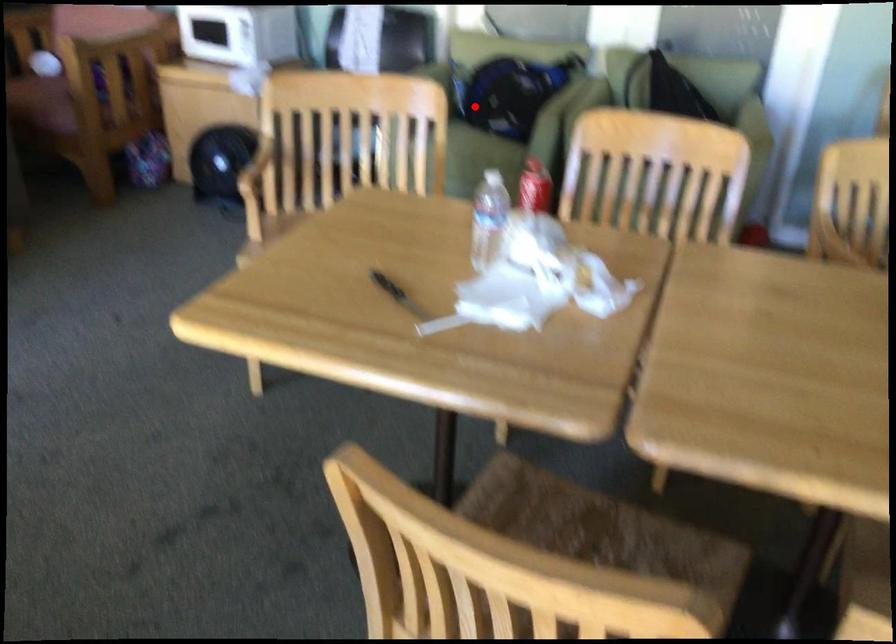
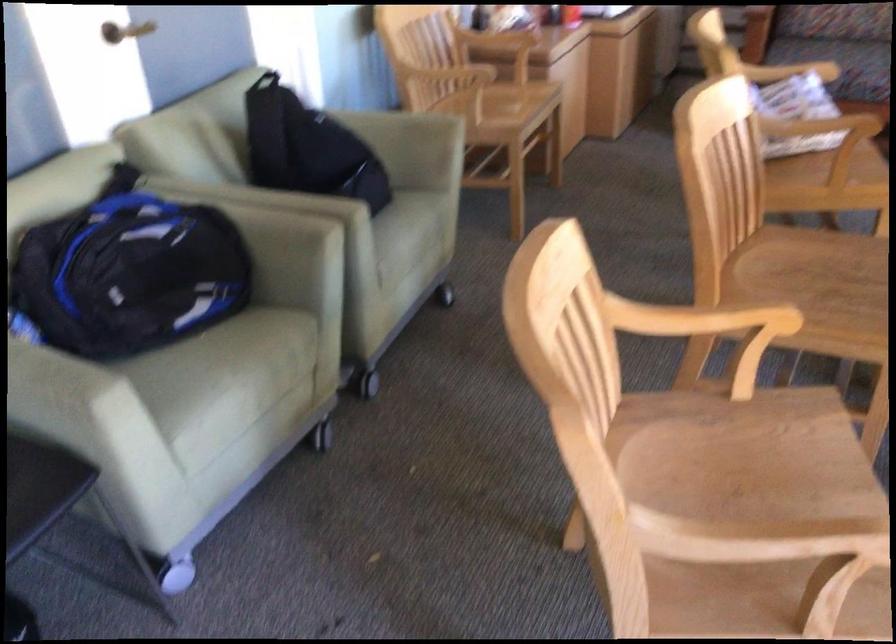
The point at the highlighted location is marked in the first image. Where is the corresponding point in the second image?

(126, 315)